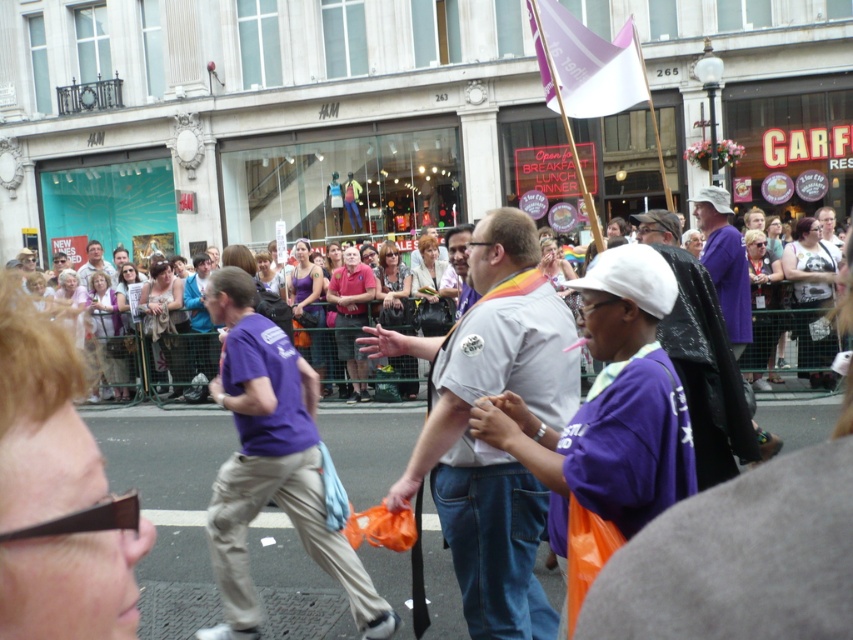
You are a photographer standing at the edge of the street. You want to take a photo of the matte purple shirt at center without the light gray shirt at center blocking it. What should you do?

The light gray shirt at center is in front of the matte purple shirt at center, so you should move to a position where the light gray shirt at center is no longer between you and the matte purple shirt at center.

You are a photographer standing in the crowd and want to take a photo of the light gray shirt at center and the matte purple shirt at center. Which shirt should you focus on first to ensure both are in the frame?

The light gray shirt at center is positioned under the matte purple shirt at center, so you should focus on the matte purple shirt at center first to ensure both are visible in the frame.

You are a photographer trying to capture the purple fabric shirt at center and the purple fabric flag at upper center in the same frame. Which object should you focus on first to ensure both are in focus?

The purple fabric flag at upper center is in front of the purple fabric shirt at center. To ensure both are in focus, you should focus on the purple fabric flag at upper center first, as it is closer to the camera.